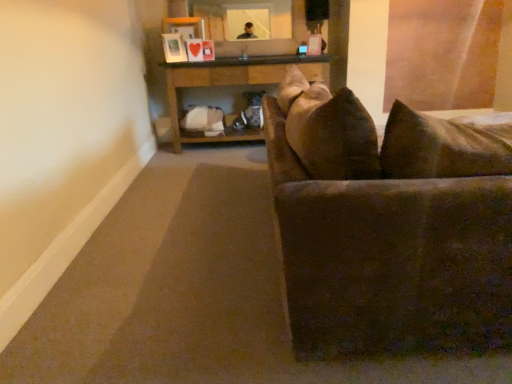
This screenshot has width=512, height=384. Find the location of `space that is in front of wooden table at center`. space that is in front of wooden table at center is located at coordinates (224, 170).